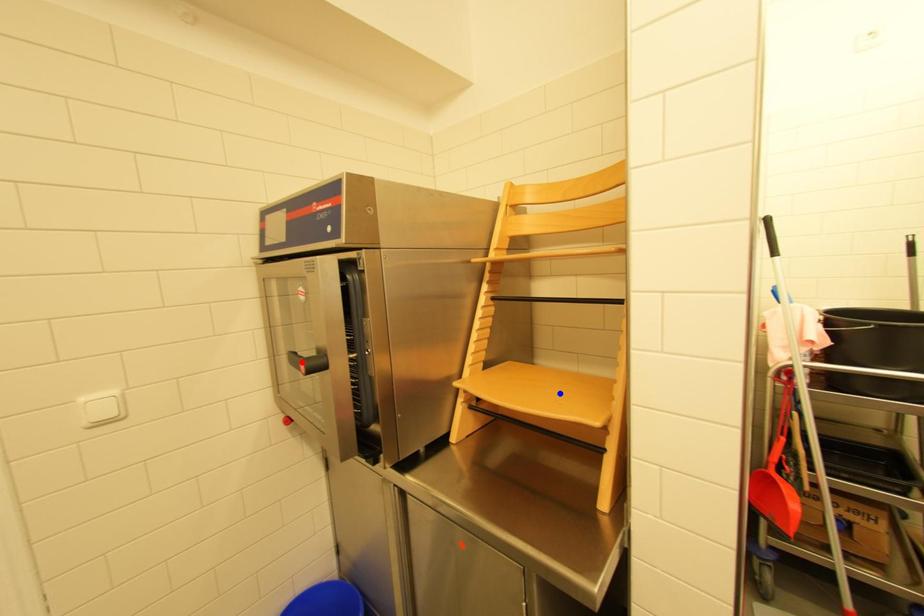
Question: In the image, two points are highlighted. Which point is nearer to the camera? Reply with the corresponding letter.

Choices:
 (A) blue point
 (B) red point

Answer: (B)